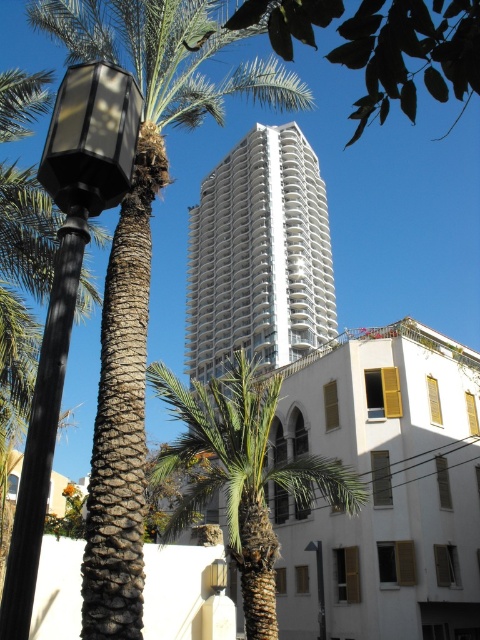
Can you confirm if brown textured palm tree at left is bigger than metallic gray streetlamp at center?

Correct, brown textured palm tree at left is larger in size than metallic gray streetlamp at center.

Identify the location of brown textured palm tree at left. click(x=141, y=259).

Which is in front, point (127, 26) or point (319, 637)?

Point (127, 26) is in front.

Identify the location of brown textured palm tree at left. Image resolution: width=480 pixels, height=640 pixels. (141, 259).

Does matte black lamp post at left appear over metallic gray streetlamp at center?

Yes.

Can you confirm if matte black lamp post at left is bigger than metallic gray streetlamp at center?

No, matte black lamp post at left is not bigger than metallic gray streetlamp at center.

This screenshot has height=640, width=480. In order to click on matte black lamp post at left in this screenshot , I will do (67, 285).

Can you confirm if brown textured palm tree at left is taller than green leafy tree at upper center?

Yes, brown textured palm tree at left is taller than green leafy tree at upper center.

Does brown textured palm tree at left appear over green leafy tree at upper center?

Yes, brown textured palm tree at left is above green leafy tree at upper center.

Who is more forward, (x=139, y=410) or (x=454, y=26)?

Point (x=454, y=26) is in front.

Identify the location of brown textured palm tree at left. The image size is (480, 640). (141, 259).